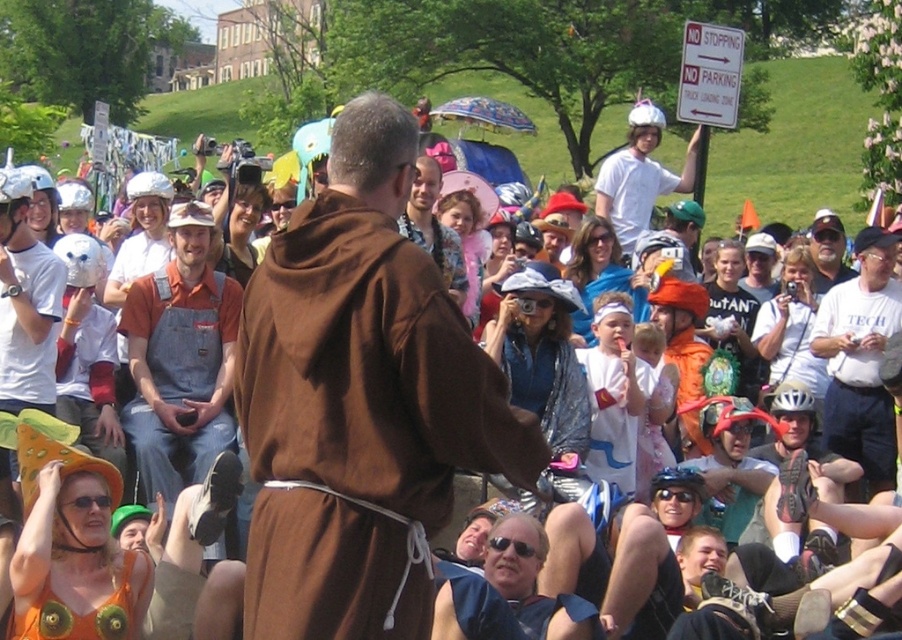
Question: Is the position of denim overalls at center less distant than that of white cotton shirt at center?

Choices:
 (A) yes
 (B) no

Answer: (A)

Question: Is brown cloth at center above white matte helmet at upper center?

Choices:
 (A) yes
 (B) no

Answer: (B)

Question: Which point is farther to the camera?

Choices:
 (A) (853, 323)
 (B) (640, 166)

Answer: (B)

Question: Which object is farther from the camera taking this photo?

Choices:
 (A) white matte helmet at upper center
 (B) brown cloth at center

Answer: (A)

Question: Which object is the closest to the white matte helmet at upper center?

Choices:
 (A) white cotton shirt at center
 (B) denim overalls at center

Answer: (A)

Question: Observing the image, what is the correct spatial positioning of denim overalls at center in reference to white matte helmet at upper center?

Choices:
 (A) left
 (B) right

Answer: (A)